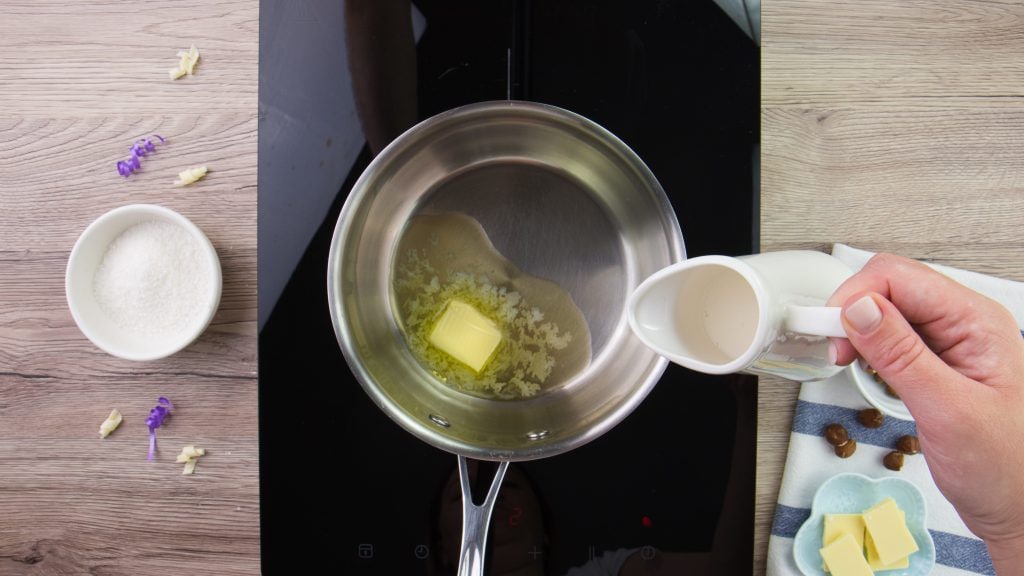
The width and height of the screenshot is (1024, 576). I want to click on black electric burner, so click(332, 131).